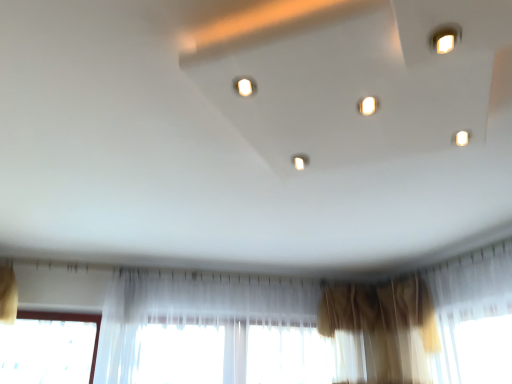
Question: Considering the relative positions of matte white light at center, which is the first light in front-to-back order, and translucent fabric curtain at lower center, which ranks as the 2th curtain in right-to-left order, in the image provided, is matte white light at center, which is the first light in front-to-back order, to the left of translucent fabric curtain at lower center, which ranks as the 2th curtain in right-to-left order, from the viewer's perspective?

Choices:
 (A) yes
 (B) no

Answer: (B)

Question: Is matte white light at center, the second light from the bottom, further to the viewer compared to translucent fabric curtain at lower center, placed as the 1th curtain when sorted from left to right?

Choices:
 (A) no
 (B) yes

Answer: (A)

Question: Does matte white light at center, the second light when ordered from back to front, have a greater height compared to translucent fabric curtain at lower center, which ranks as the 2th curtain in right-to-left order?

Choices:
 (A) yes
 (B) no

Answer: (B)

Question: Does matte white light at center, positioned as the 1th light in top-to-bottom order, contain translucent fabric curtain at lower center, placed as the 1th curtain when sorted from left to right?

Choices:
 (A) no
 (B) yes

Answer: (A)

Question: Is matte white light at center, which appears as the second light when viewed from the right, in front of translucent fabric curtain at lower center, placed as the 1th curtain when sorted from left to right?

Choices:
 (A) yes
 (B) no

Answer: (A)

Question: Can you confirm if matte white light at center, which is the first light in front-to-back order, is thinner than translucent fabric curtain at lower center, placed as the 1th curtain when sorted from left to right?

Choices:
 (A) no
 (B) yes

Answer: (B)

Question: Is the depth of matte white light at center, positioned as the 1th light in top-to-bottom order, greater than that of brown sheer curtain at lower right, which is the 2th curtain from left to right?

Choices:
 (A) no
 (B) yes

Answer: (A)

Question: Can you confirm if matte white light at center, which is the first light in front-to-back order, is thinner than brown sheer curtain at lower right, the first curtain in the right-to-left sequence?

Choices:
 (A) yes
 (B) no

Answer: (A)

Question: Is matte white light at center, the second light when ordered from back to front, to the left of brown sheer curtain at lower right, the first curtain in the right-to-left sequence, from the viewer's perspective?

Choices:
 (A) no
 (B) yes

Answer: (B)

Question: From a real-world perspective, is matte white light at center, which is the first light in front-to-back order, below brown sheer curtain at lower right, which is the 2th curtain from left to right?

Choices:
 (A) yes
 (B) no

Answer: (B)

Question: Is matte white light at center, the second light from the bottom, facing away from brown sheer curtain at lower right, the first curtain in the right-to-left sequence?

Choices:
 (A) yes
 (B) no

Answer: (B)

Question: Would you say brown sheer curtain at lower right, the first curtain in the right-to-left sequence, is part of matte white light at center, which appears as the second light when viewed from the right,'s contents?

Choices:
 (A) no
 (B) yes

Answer: (A)

Question: From the image's perspective, is brown sheer curtain at lower right, the first curtain in the right-to-left sequence, under matte white light at center, which appears as the second light when viewed from the right?

Choices:
 (A) no
 (B) yes

Answer: (B)